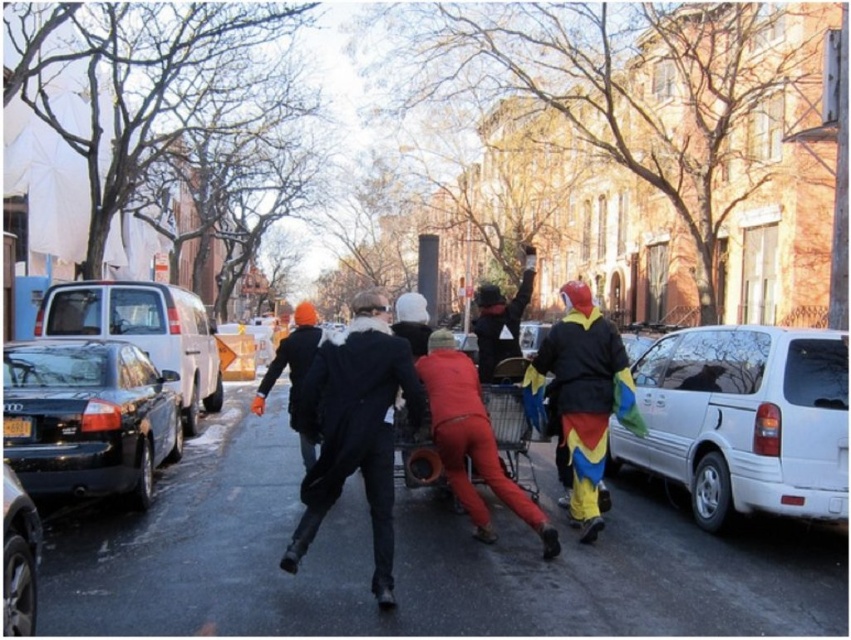
Question: Estimate the real-world distances between objects in this image. Which object is closer to the white matte van at right?

Choices:
 (A) shiny black sedan at left
 (B) shiny black van at left
 (C) multicolored fabric pants at right
 (D) metallic silver shopping cart at center

Answer: (C)

Question: Which point is closer to the camera taking this photo?

Choices:
 (A) click(595, 480)
 (B) click(7, 374)
 (C) click(510, 392)
 (D) click(21, 593)

Answer: (D)

Question: Can you confirm if multicolored fabric pants at right is smaller than shiny black car at lower left?

Choices:
 (A) yes
 (B) no

Answer: (B)

Question: Can you confirm if shiny black sedan at left is positioned to the left of black wool coat at center?

Choices:
 (A) yes
 (B) no

Answer: (A)

Question: Is white matte van at right to the left of metallic silver shopping cart at center from the viewer's perspective?

Choices:
 (A) no
 (B) yes

Answer: (A)

Question: Which of the following is the closest to the observer?

Choices:
 (A) (523, 481)
 (B) (104, 474)
 (C) (126, 324)

Answer: (B)